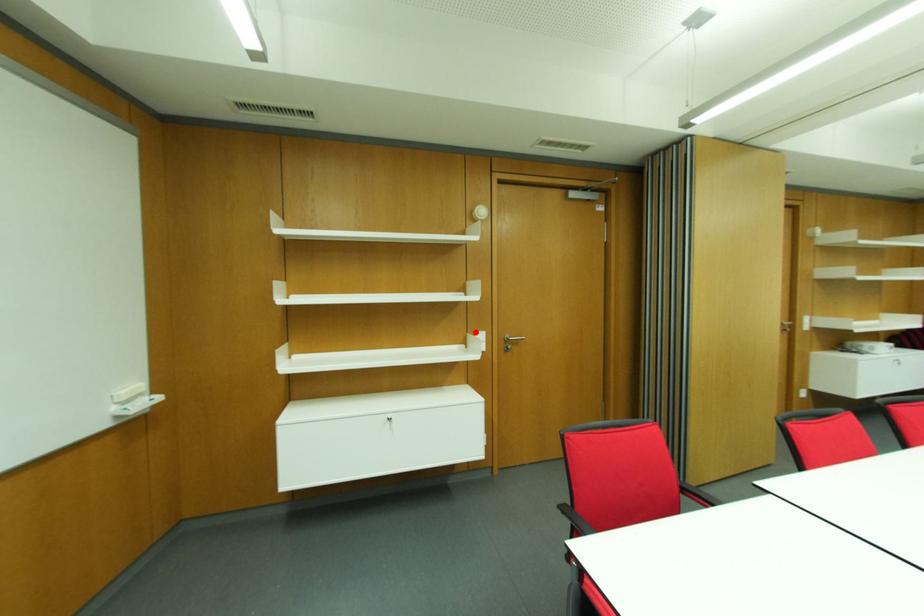
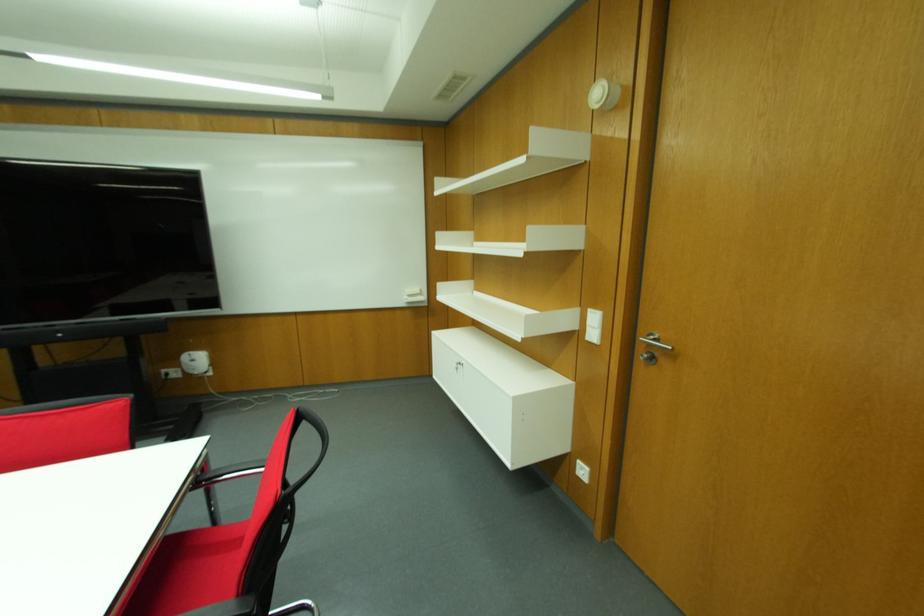
The point at the highlighted location is marked in the first image. Where is the corresponding point in the second image?

(589, 310)